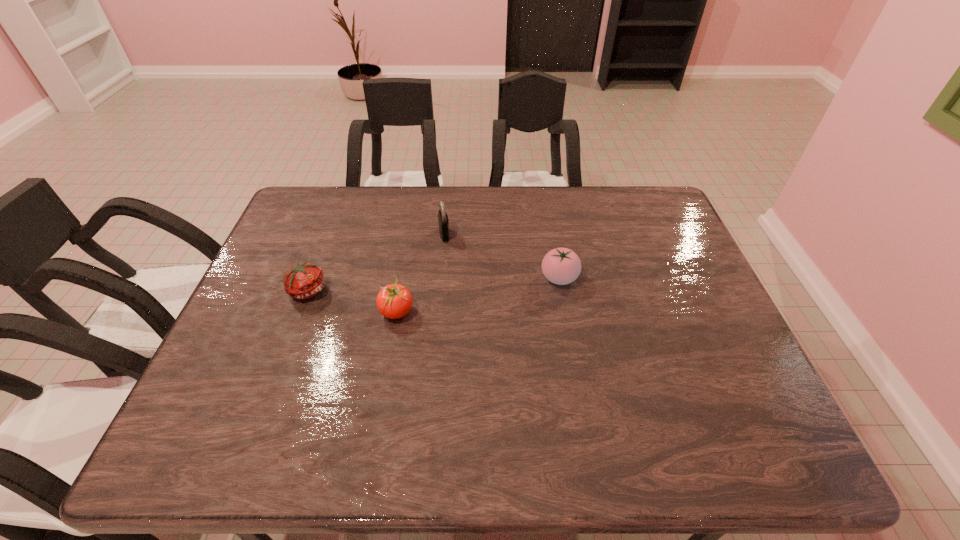
Find the location of a particular element. This screenshot has width=960, height=540. free spot that satisfies the following two spatial constraints: 1. on the back side of the rightmost tomato; 2. on the right side of the second object from left to right is located at coordinates (402, 278).

Identify the location of free location that satisfies the following two spatial constraints: 1. on the back side of the padlock; 2. on the right side of the second tomato from right to left. Image resolution: width=960 pixels, height=540 pixels. (410, 234).

The image size is (960, 540). Identify the location of blank area in the image that satisfies the following two spatial constraints: 1. on the back side of the leftmost object; 2. on the right side of the tallest object. (329, 234).

At what (x,y) coordinates should I click in order to perform the action: click on free location that satisfies the following two spatial constraints: 1. on the front side of the leftmost object; 2. on the right side of the second object from left to right. Please return your answer as a coordinate pair (x, y). This screenshot has height=540, width=960. Looking at the image, I should click on (300, 312).

At what (x,y) coordinates should I click in order to perform the action: click on vacant region that satisfies the following two spatial constraints: 1. on the front side of the second object from left to right; 2. on the right side of the leftmost tomato. Please return your answer as a coordinate pair (x, y). The image size is (960, 540). Looking at the image, I should click on (300, 312).